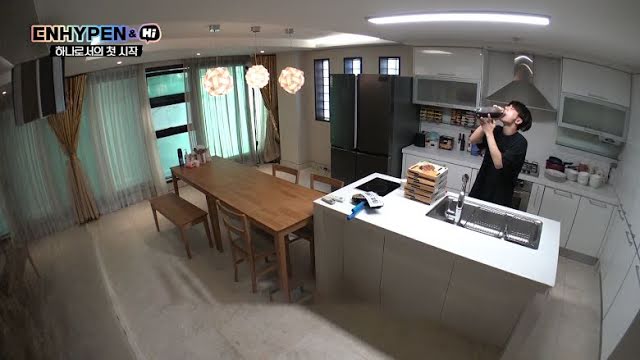
You are a GUI agent. You are given a task and a screenshot of the screen. Output one action in this format:
    pyautogui.click(x=<x>, y=<y>)
    Task: Click on the table
    Image resolution: width=640 pixels, height=360 pixels.
    Given the screenshot: What is the action you would take?
    pyautogui.click(x=262, y=204)